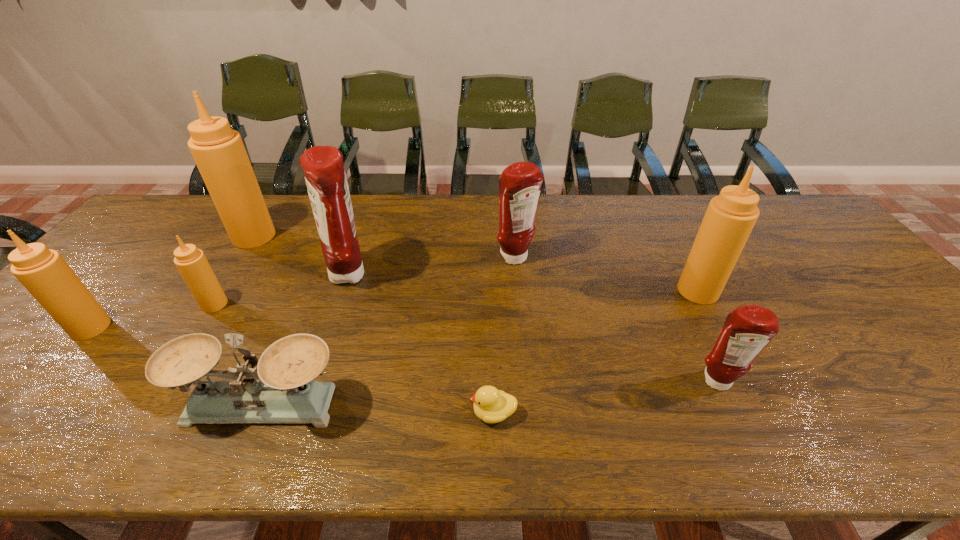
Identify the location of vacant space situated on the left of the smallest tan condiment. (138, 304).

I want to click on free point located 0.190m on the left of the smallest red condiment, so click(611, 382).

Where is `vacant space located 0.290m on the beak of the duckling`? vacant space located 0.290m on the beak of the duckling is located at coordinates (333, 413).

In order to click on free space located 0.090m on the beak of the duckling in this screenshot , I will do [428, 413].

Find the location of a particular element. This screenshot has width=960, height=540. vacant space situated 0.240m on the beak of the duckling is located at coordinates (357, 413).

This screenshot has width=960, height=540. Identify the location of object present at the far edge. (218, 151).

Where is `scale located at the near edge`? scale located at the near edge is located at coordinates (286, 393).

You are a GUI agent. You are given a task and a screenshot of the screen. Output one action in this format:
    pyautogui.click(x=<x>, y=<y>)
    Task: Click on the duckling that is at the near edge
    The width and height of the screenshot is (960, 540).
    Given the screenshot: What is the action you would take?
    pyautogui.click(x=491, y=405)

Find the location of a particular element. This screenshot has width=960, height=540. object positioned at the left edge is located at coordinates (43, 272).

At what (x,y) coordinates should I click in order to perform the action: click on vacant space at the far edge of the desktop. Please return your answer as a coordinate pair (x, y). The height and width of the screenshot is (540, 960). Looking at the image, I should click on (278, 228).